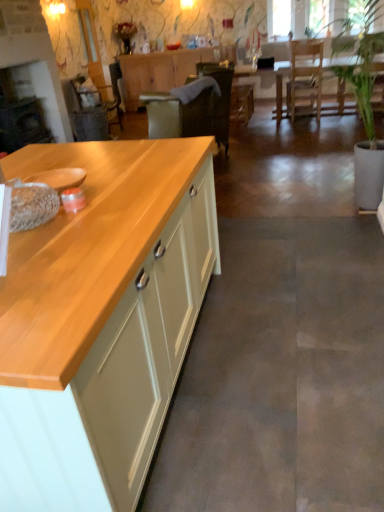
How much space does matte wood cabinet at center, placed as the 2th cabinetry when sorted from front to back, occupy horizontally?

matte wood cabinet at center, placed as the 2th cabinetry when sorted from front to back, is 21.98 inches wide.

Locate an element on the screen. Image resolution: width=384 pixels, height=512 pixels. wooden armchair at left is located at coordinates (108, 89).

Is point (105, 100) farther from camera compared to point (221, 52)?

No.

Is wooden armchair at left turned away from matte wood cabinet at center, placed as the 2th cabinetry when sorted from front to back?

That's not correct — wooden armchair at left is not looking away from matte wood cabinet at center, placed as the 2th cabinetry when sorted from front to back.

Which of these two, wooden armchair at left or matte wood cabinet at center, which ranks as the first cabinetry in back-to-front order, is wider?

wooden armchair at left.

Choose the correct answer: Is wooden armchair at left inside matte wood cabinet at center, which ranks as the first cabinetry in back-to-front order, or outside it?

wooden armchair at left is spatially situated outside matte wood cabinet at center, which ranks as the first cabinetry in back-to-front order.

Which object is wider, green leafy plant at right or wooden armchair at left?

Wider between the two is green leafy plant at right.

From the image's perspective, is green leafy plant at right below wooden armchair at left?

Yes, from the image's perspective, green leafy plant at right is below wooden armchair at left.

Can you confirm if green leafy plant at right is smaller than wooden armchair at left?

Actually, green leafy plant at right might be larger than wooden armchair at left.

Based on the photo, from a real-world perspective, which is physically below, green leafy plant at right or wooden armchair at left?

wooden armchair at left.

Considering the sizes of objects green leafy plant at right and wooden table at center in the image provided, who is thinner, green leafy plant at right or wooden table at center?

wooden table at center.

Between green leafy plant at right and wooden table at center, which one is positioned in front?

green leafy plant at right is in front.

Can you tell me how much green leafy plant at right and wooden table at center differ in facing direction?

The facing directions of green leafy plant at right and wooden table at center are 174 degrees apart.

Which object is further away from the camera taking this photo, wooden table at center or matte wood cabinet at center, the first cabinetry in the top-to-bottom sequence?

matte wood cabinet at center, the first cabinetry in the top-to-bottom sequence, is further from the camera.

Can you confirm if wooden table at center is positioned to the right of matte wood cabinet at center, placed as the 2th cabinetry when sorted from front to back?

Yes, wooden table at center is to the right of matte wood cabinet at center, placed as the 2th cabinetry when sorted from front to back.

Which object is thinner, wooden table at center or matte wood cabinet at center, the first cabinetry in the top-to-bottom sequence?

matte wood cabinet at center, the first cabinetry in the top-to-bottom sequence.

Looking at this image, how many degrees apart are the facing directions of wooden table at center and matte wood cabinet at center, the first cabinetry in the top-to-bottom sequence?

0.307 degrees separate the facing orientations of wooden table at center and matte wood cabinet at center, the first cabinetry in the top-to-bottom sequence.

From a real-world perspective, which object stands above the other?

In real-world perspective, green leafy plant at right is above.

Is the position of wooden armchair at left more distant than that of green leafy plant at right?

Yes, the depth of wooden armchair at left is greater than that of green leafy plant at right.

Which is closer to the camera, (94, 84) or (359, 54)?

The point (359, 54) is more forward.

Measure the distance between light wood/texture cabinet at left, the second cabinetry from the top, and wooden armchair at left.

light wood/texture cabinet at left, the second cabinetry from the top, is 5.46 meters away from wooden armchair at left.

Does light wood/texture cabinet at left, the first cabinetry from the front, turn towards wooden armchair at left?

No, light wood/texture cabinet at left, the first cabinetry from the front, does not turn towards wooden armchair at left.

Considering the relative positions of light wood/texture cabinet at left, placed as the 2th cabinetry when sorted from back to front, and wooden armchair at left in the image provided, is light wood/texture cabinet at left, placed as the 2th cabinetry when sorted from back to front, behind wooden armchair at left?

That is False.

From the image's perspective, which object appears higher, light wood/texture cabinet at left, marked as the 1th cabinetry in a bottom-to-top arrangement, or wooden armchair at left?

wooden armchair at left.

Which object is positioned more to the right, wooden table at center or light wood/texture cabinet at left, marked as the 1th cabinetry in a bottom-to-top arrangement?

wooden table at center is more to the right.

From a real-world perspective, is wooden table at center positioned under light wood/texture cabinet at left, marked as the 1th cabinetry in a bottom-to-top arrangement, based on gravity?

Yes, from a real-world perspective, wooden table at center is below light wood/texture cabinet at left, marked as the 1th cabinetry in a bottom-to-top arrangement.

Where is `table on the right side of light wood/texture cabinet at left, placed as the 2th cabinetry when sorted from back to front`? table on the right side of light wood/texture cabinet at left, placed as the 2th cabinetry when sorted from back to front is located at coordinates (267, 75).

I want to click on cabinetry that is above the wooden armchair at left (from the image's perspective), so click(165, 70).

The width and height of the screenshot is (384, 512). Identify the location of plant below the wooden armchair at left (from the image's perspective). (360, 61).

Based on their spatial positions, is light wood/texture cabinet at left, placed as the 2th cabinetry when sorted from back to front, or wooden armchair at left closer to matte wood cabinet at center, the first cabinetry in the top-to-bottom sequence?

wooden armchair at left is positioned closer to the anchor matte wood cabinet at center, the first cabinetry in the top-to-bottom sequence.

Consider the image. Considering their positions, is matte wood cabinet at center, which ranks as the first cabinetry in back-to-front order, positioned closer to wooden table at center than wooden armchair at left?

matte wood cabinet at center, which ranks as the first cabinetry in back-to-front order, lies closer to wooden table at center than the other object.

From the image, which object appears to be nearer to wooden table at center, light wood/texture cabinet at left, marked as the 1th cabinetry in a bottom-to-top arrangement, or matte wood cabinet at center, placed as the 2th cabinetry when sorted from front to back?

Based on the image, matte wood cabinet at center, placed as the 2th cabinetry when sorted from front to back, appears to be nearer to wooden table at center.

When comparing their distances from wooden armchair at left, does matte wood cabinet at center, placed as the 2th cabinetry when sorted from front to back, or green leafy plant at right seem closer?

The object closer to wooden armchair at left is matte wood cabinet at center, placed as the 2th cabinetry when sorted from front to back.

Considering their positions, is wooden table at center positioned further to green leafy plant at right than light wood/texture cabinet at left, placed as the 2th cabinetry when sorted from back to front?

Based on the image, wooden table at center appears to be further to green leafy plant at right.

From the image, which object appears to be farther from light wood/texture cabinet at left, marked as the 1th cabinetry in a bottom-to-top arrangement, matte wood cabinet at center, placed as the 2th cabinetry when sorted from front to back, or wooden table at center?

Among the two, matte wood cabinet at center, placed as the 2th cabinetry when sorted from front to back, is located further to light wood/texture cabinet at left, marked as the 1th cabinetry in a bottom-to-top arrangement.

Considering their positions, is green leafy plant at right positioned closer to wooden armchair at left than wooden table at center?

Among the two, wooden table at center is located nearer to wooden armchair at left.

Based on their spatial positions, is light wood/texture cabinet at left, marked as the 1th cabinetry in a bottom-to-top arrangement, or wooden table at center further from wooden armchair at left?

light wood/texture cabinet at left, marked as the 1th cabinetry in a bottom-to-top arrangement, lies further to wooden armchair at left than the other object.

I want to click on table located between light wood/texture cabinet at left, the second cabinetry from the top, and matte wood cabinet at center, the second cabinetry in the bottom-to-top sequence, in the depth direction, so click(x=267, y=75).

This screenshot has height=512, width=384. Identify the location of table positioned between light wood/texture cabinet at left, marked as the 1th cabinetry in a bottom-to-top arrangement, and wooden armchair at left from near to far. (267, 75).

You are a GUI agent. You are given a task and a screenshot of the screen. Output one action in this format:
    pyautogui.click(x=<x>, y=<y>)
    Task: Click on the armchair located between green leafy plant at right and matte wood cabinet at center, placed as the 2th cabinetry when sorted from front to back, in the depth direction
    The height and width of the screenshot is (512, 384).
    Given the screenshot: What is the action you would take?
    pyautogui.click(x=108, y=89)

In order to click on plant positioned between light wood/texture cabinet at left, the second cabinetry from the top, and wooden table at center from near to far in this screenshot , I will do `click(360, 61)`.